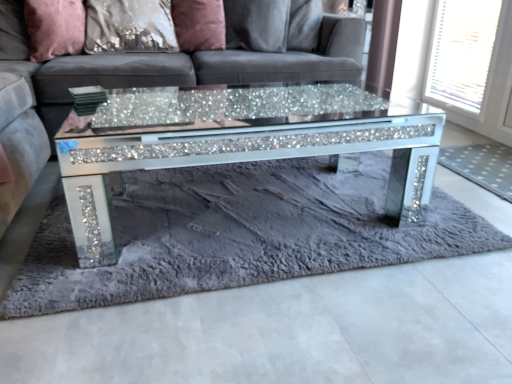
Question: Is satin sequin pillow at upper center, which ranks as the 2th pillow in right-to-left order, not near fuzzy gray rug at center, which is the 1th mat from left to right?

Choices:
 (A) yes
 (B) no

Answer: (A)

Question: Can you confirm if satin sequin pillow at upper center, which ranks as the 2th pillow in right-to-left order, is smaller than fuzzy gray rug at center, which is the 1th mat from left to right?

Choices:
 (A) no
 (B) yes

Answer: (A)

Question: Is satin sequin pillow at upper center, arranged as the second pillow when viewed from the left, oriented away from fuzzy gray rug at center, which is the 1th mat from left to right?

Choices:
 (A) no
 (B) yes

Answer: (A)

Question: From a real-world perspective, is satin sequin pillow at upper center, which ranks as the 2th pillow in right-to-left order, below fuzzy gray rug at center, the second mat positioned from the right?

Choices:
 (A) yes
 (B) no

Answer: (B)

Question: Is the position of satin sequin pillow at upper center, arranged as the second pillow when viewed from the left, more distant than that of fuzzy gray rug at center, which is the 1th mat from left to right?

Choices:
 (A) no
 (B) yes

Answer: (B)

Question: Does point (190, 18) appear closer or farther from the camera than point (429, 79)?

Choices:
 (A) farther
 (B) closer

Answer: (B)

Question: Is satin pink pillow at upper center, the third pillow from the left, wider or thinner than white mesh screen at upper right?

Choices:
 (A) thin
 (B) wide

Answer: (B)

Question: Considering the positions of satin pink pillow at upper center, the first pillow positioned from the right, and white mesh screen at upper right in the image, is satin pink pillow at upper center, the first pillow positioned from the right, bigger or smaller than white mesh screen at upper right?

Choices:
 (A) big
 (B) small

Answer: (A)

Question: From a real-world perspective, is satin pink pillow at upper center, the first pillow positioned from the right, above or below white mesh screen at upper right?

Choices:
 (A) above
 (B) below

Answer: (A)

Question: Is point (460, 77) closer or farther from the camera than point (507, 160)?

Choices:
 (A) closer
 (B) farther

Answer: (B)

Question: Considering their positions, is white mesh screen at upper right located in front of or behind white dotted mat at right, the 2th mat in the left-to-right sequence?

Choices:
 (A) behind
 (B) front

Answer: (A)

Question: From a real-world perspective, is white mesh screen at upper right above or below white dotted mat at right, the 2th mat in the left-to-right sequence?

Choices:
 (A) above
 (B) below

Answer: (A)

Question: Is white mesh screen at upper right wider or thinner than white dotted mat at right, which is the first mat from right to left?

Choices:
 (A) thin
 (B) wide

Answer: (A)

Question: Visually, is sparkly glass coffee table at center positioned to the left or to the right of pink velvet pillow at upper left, which is counted as the third pillow, starting from the right?

Choices:
 (A) right
 (B) left

Answer: (A)

Question: Is sparkly glass coffee table at center wider or thinner than pink velvet pillow at upper left, which is the first pillow in left-to-right order?

Choices:
 (A) thin
 (B) wide

Answer: (B)